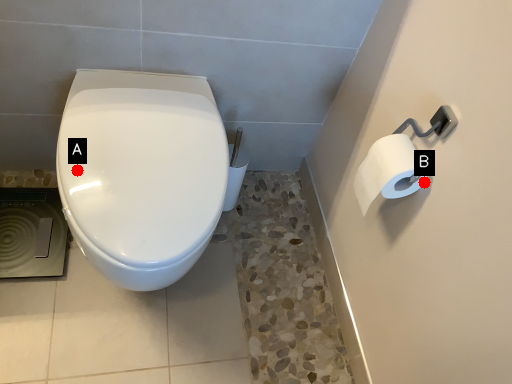
Question: Two points are circled on the image, labeled by A and B beside each circle. Which point is closer to the camera?

Choices:
 (A) A is closer
 (B) B is closer

Answer: (A)